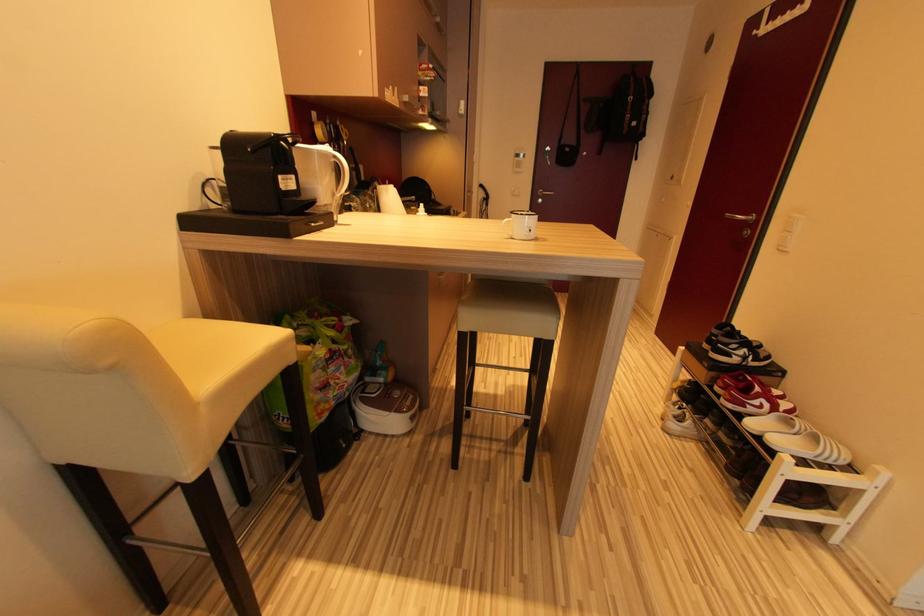
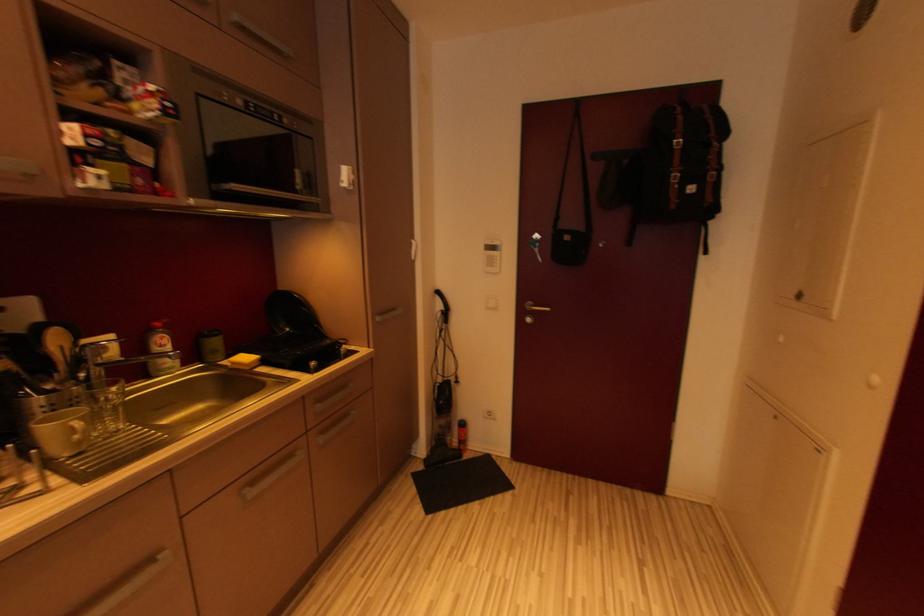
Which direction would the cameraman need to move to produce the second image?

The cameraman moved toward right, forward.